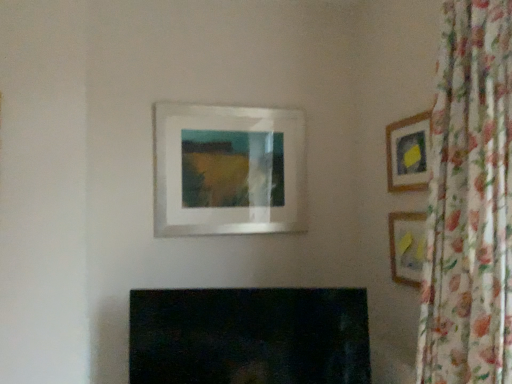
What do you see at coordinates (408, 153) in the screenshot?
I see `wooden frame at upper right, which appears as the second picture frame when viewed from the left` at bounding box center [408, 153].

Locate an element on the screen. wooden frame at upper right, the 2th picture frame when ordered from right to left is located at coordinates (408, 153).

Where is `matte glass picture frame at center, positioned as the first picture frame in left-to-right order`? The height and width of the screenshot is (384, 512). matte glass picture frame at center, positioned as the first picture frame in left-to-right order is located at coordinates (228, 170).

Locate an element on the screen. This screenshot has width=512, height=384. wooden frame at upper right, which appears as the second picture frame when viewed from the left is located at coordinates (408, 153).

Considering the relative sizes of wooden frame at right, which is the 3th picture frame in left-to-right order, and floral fabric curtain at right in the image provided, is wooden frame at right, which is the 3th picture frame in left-to-right order, bigger than floral fabric curtain at right?

Actually, wooden frame at right, which is the 3th picture frame in left-to-right order, might be smaller than floral fabric curtain at right.

Can you confirm if wooden frame at right, which is the 3th picture frame in left-to-right order, is positioned to the left of floral fabric curtain at right?

No.

Which picture frame is the 2nd one when counting from the right side of the floral fabric curtain at right? Please provide its 2D coordinates.

[(407, 247)]

Who is more distant, floral fabric curtain at right or wooden frame at upper right, which appears as the second picture frame when viewed from the left?

wooden frame at upper right, which appears as the second picture frame when viewed from the left, is behind.

How many degrees apart are the facing directions of floral fabric curtain at right and wooden frame at upper right, which appears as the second picture frame when viewed from the left?

0.505 degrees.

Is wooden frame at upper right, the 2th picture frame when ordered from right to left, located within floral fabric curtain at right?

No.

From the image's perspective, which one is positioned higher, floral fabric curtain at right or wooden frame at upper right, the 2th picture frame when ordered from right to left?

wooden frame at upper right, the 2th picture frame when ordered from right to left, from the image's perspective.

Measure the distance between wooden frame at right, which is the 3th picture frame in left-to-right order, and wooden frame at upper right, the 2th picture frame when ordered from right to left.

wooden frame at right, which is the 3th picture frame in left-to-right order, and wooden frame at upper right, the 2th picture frame when ordered from right to left, are 11.42 inches apart from each other.

Based on the photo, is wooden frame at right, which is the 3th picture frame in left-to-right order, wider than wooden frame at upper right, the 2th picture frame when ordered from right to left?

Yes, wooden frame at right, which is the 3th picture frame in left-to-right order, is wider than wooden frame at upper right, the 2th picture frame when ordered from right to left.

Is wooden frame at right, which appears as the 1th picture frame when viewed from the right, not close to wooden frame at upper right, the 2th picture frame when ordered from right to left?

No, there isn't a large distance between wooden frame at right, which appears as the 1th picture frame when viewed from the right, and wooden frame at upper right, the 2th picture frame when ordered from right to left.

Could you tell me if wooden frame at right, which is the 3th picture frame in left-to-right order, is turned towards wooden frame at upper right, the 2th picture frame when ordered from right to left?

No, wooden frame at right, which is the 3th picture frame in left-to-right order, is not oriented towards wooden frame at upper right, the 2th picture frame when ordered from right to left.

Measure the distance between matte glass picture frame at center, positioned as the 3th picture frame in right-to-left order, and wooden frame at upper right, the 2th picture frame when ordered from right to left.

They are 31.61 inches apart.

From the image's perspective, does matte glass picture frame at center, positioned as the first picture frame in left-to-right order, appear lower than wooden frame at upper right, the 2th picture frame when ordered from right to left?

Correct, matte glass picture frame at center, positioned as the first picture frame in left-to-right order, appears lower than wooden frame at upper right, the 2th picture frame when ordered from right to left, in the image.

Is matte glass picture frame at center, positioned as the first picture frame in left-to-right order, located outside wooden frame at upper right, which appears as the second picture frame when viewed from the left?

matte glass picture frame at center, positioned as the first picture frame in left-to-right order, is positioned outside wooden frame at upper right, which appears as the second picture frame when viewed from the left.

Considering the points (220, 152) and (405, 157), which point is in front, point (220, 152) or point (405, 157)?

The point (405, 157) is more forward.

Between point (389, 143) and point (419, 270), which one is positioned in front?

The point (419, 270) is closer to the camera.

From a real-world perspective, is wooden frame at upper right, the 2th picture frame when ordered from right to left, physically above wooden frame at right, which is the 3th picture frame in left-to-right order?

Correct, in the physical world, wooden frame at upper right, the 2th picture frame when ordered from right to left, is higher than wooden frame at right, which is the 3th picture frame in left-to-right order.

Does wooden frame at upper right, the 2th picture frame when ordered from right to left, turn towards wooden frame at right, which is the 3th picture frame in left-to-right order?

No.

How distant is wooden frame at upper right, which appears as the second picture frame when viewed from the left, from wooden frame at right, which appears as the 1th picture frame when viewed from the right?

wooden frame at upper right, which appears as the second picture frame when viewed from the left, and wooden frame at right, which appears as the 1th picture frame when viewed from the right, are 11.42 inches apart.

Consider the image. Considering the relative positions of matte glass picture frame at center, positioned as the first picture frame in left-to-right order, and wooden frame at right, which is the 3th picture frame in left-to-right order, in the image provided, is matte glass picture frame at center, positioned as the first picture frame in left-to-right order, to the left of wooden frame at right, which is the 3th picture frame in left-to-right order, from the viewer's perspective?

Yes.

Which object is closer to the camera taking this photo, matte glass picture frame at center, positioned as the first picture frame in left-to-right order, or wooden frame at right, which is the 3th picture frame in left-to-right order?

wooden frame at right, which is the 3th picture frame in left-to-right order, is in front.

Which object is thinner, matte glass picture frame at center, positioned as the 3th picture frame in right-to-left order, or wooden frame at right, which is the 3th picture frame in left-to-right order?

wooden frame at right, which is the 3th picture frame in left-to-right order, is thinner.

Is matte glass picture frame at center, positioned as the first picture frame in left-to-right order, not near wooden frame at right, which is the 3th picture frame in left-to-right order?

matte glass picture frame at center, positioned as the first picture frame in left-to-right order, is near wooden frame at right, which is the 3th picture frame in left-to-right order, not far away.

Is point (496, 251) less distant than point (182, 148)?

That is True.

Between floral fabric curtain at right and matte glass picture frame at center, positioned as the first picture frame in left-to-right order, which one has more height?

floral fabric curtain at right.

Does floral fabric curtain at right have a larger size compared to matte glass picture frame at center, positioned as the first picture frame in left-to-right order?

Correct, floral fabric curtain at right is larger in size than matte glass picture frame at center, positioned as the first picture frame in left-to-right order.

The image size is (512, 384). Identify the location of curtain on the right of matte glass picture frame at center, positioned as the 3th picture frame in right-to-left order. (470, 202).

At what (x,y) coordinates should I click in order to perform the action: click on curtain located above the wooden frame at right, which appears as the 1th picture frame when viewed from the right (from a real-world perspective). Please return your answer as a coordinate pair (x, y). Looking at the image, I should click on (470, 202).

I want to click on curtain that is under the wooden frame at upper right, which appears as the second picture frame when viewed from the left (from a real-world perspective), so click(x=470, y=202).

When comparing their distances from wooden frame at upper right, which appears as the second picture frame when viewed from the left, does wooden frame at right, which appears as the 1th picture frame when viewed from the right, or matte glass picture frame at center, positioned as the first picture frame in left-to-right order, seem closer?

wooden frame at right, which appears as the 1th picture frame when viewed from the right.

Estimate the real-world distances between objects in this image. Which object is closer to wooden frame at upper right, which appears as the second picture frame when viewed from the left, matte glass picture frame at center, positioned as the first picture frame in left-to-right order, or floral fabric curtain at right?

floral fabric curtain at right is positioned closer to the anchor wooden frame at upper right, which appears as the second picture frame when viewed from the left.

Estimate the real-world distances between objects in this image. Which object is closer to floral fabric curtain at right, wooden frame at right, which appears as the 1th picture frame when viewed from the right, or matte glass picture frame at center, positioned as the first picture frame in left-to-right order?

Based on the image, wooden frame at right, which appears as the 1th picture frame when viewed from the right, appears to be nearer to floral fabric curtain at right.

Looking at the image, which one is located further to wooden frame at upper right, which appears as the second picture frame when viewed from the left, matte glass picture frame at center, positioned as the first picture frame in left-to-right order, or wooden frame at right, which is the 3th picture frame in left-to-right order?

matte glass picture frame at center, positioned as the first picture frame in left-to-right order, is positioned further to the anchor wooden frame at upper right, which appears as the second picture frame when viewed from the left.

When comparing their distances from wooden frame at right, which is the 3th picture frame in left-to-right order, does wooden frame at upper right, which appears as the second picture frame when viewed from the left, or matte glass picture frame at center, positioned as the 3th picture frame in right-to-left order, seem closer?

The object closer to wooden frame at right, which is the 3th picture frame in left-to-right order, is wooden frame at upper right, which appears as the second picture frame when viewed from the left.

Based on their spatial positions, is floral fabric curtain at right or wooden frame at right, which is the 3th picture frame in left-to-right order, further from matte glass picture frame at center, positioned as the first picture frame in left-to-right order?

Based on the image, floral fabric curtain at right appears to be further to matte glass picture frame at center, positioned as the first picture frame in left-to-right order.

Looking at the image, which one is located further to wooden frame at right, which is the 3th picture frame in left-to-right order, matte glass picture frame at center, positioned as the first picture frame in left-to-right order, or wooden frame at upper right, which appears as the second picture frame when viewed from the left?

matte glass picture frame at center, positioned as the first picture frame in left-to-right order.

From the image, which object appears to be nearer to matte glass picture frame at center, positioned as the 3th picture frame in right-to-left order, floral fabric curtain at right or wooden frame at upper right, which appears as the second picture frame when viewed from the left?

wooden frame at upper right, which appears as the second picture frame when viewed from the left, is closer to matte glass picture frame at center, positioned as the 3th picture frame in right-to-left order.

The image size is (512, 384). I want to click on picture frame between matte glass picture frame at center, positioned as the 3th picture frame in right-to-left order, and wooden frame at right, which appears as the 1th picture frame when viewed from the right, from left to right, so click(x=408, y=153).

The width and height of the screenshot is (512, 384). In order to click on picture frame between floral fabric curtain at right and wooden frame at upper right, the 2th picture frame when ordered from right to left, along the z-axis in this screenshot , I will do `click(407, 247)`.